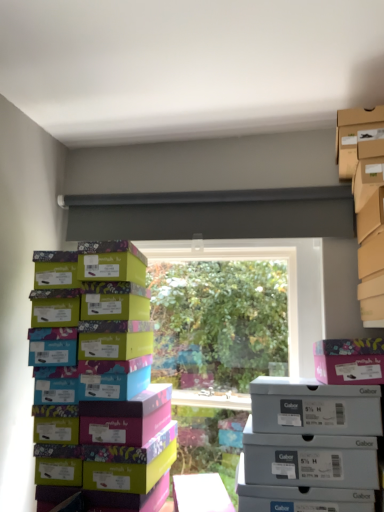
Question: Is gray matte shoebox at lower right, the second storage box positioned from the top, further to the viewer compared to cardboard shoebox at upper right, placed as the 1th storage box when sorted from top to bottom?

Choices:
 (A) no
 (B) yes

Answer: (A)

Question: Is gray matte shoebox at lower right, the second storage box positioned from the top, surrounding cardboard shoebox at upper right, placed as the 1th storage box when sorted from top to bottom?

Choices:
 (A) no
 (B) yes

Answer: (A)

Question: Could you tell me if gray matte shoebox at lower right, positioned as the 1th storage box in bottom-to-top order, is turned towards cardboard shoebox at upper right, placed as the 1th storage box when sorted from top to bottom?

Choices:
 (A) yes
 (B) no

Answer: (B)

Question: From the image's perspective, would you say gray matte shoebox at lower right, positioned as the 1th storage box in bottom-to-top order, is positioned over cardboard shoebox at upper right, the second storage box ordered from the bottom?

Choices:
 (A) no
 (B) yes

Answer: (A)

Question: Is gray matte shoebox at lower right, the second storage box positioned from the top, bigger than cardboard shoebox at upper right, placed as the 1th storage box when sorted from top to bottom?

Choices:
 (A) yes
 (B) no

Answer: (A)

Question: From a real-world perspective, is gray matte shoebox at lower right, positioned as the 1th storage box in bottom-to-top order, on top of cardboard shoebox at upper right, placed as the 1th storage box when sorted from top to bottom?

Choices:
 (A) no
 (B) yes

Answer: (A)

Question: Is pink cardboard box at upper right thinner than cardboard shoebox at upper right, the second storage box ordered from the bottom?

Choices:
 (A) no
 (B) yes

Answer: (B)

Question: From the image's perspective, would you say pink cardboard box at upper right is shown under cardboard shoebox at upper right, the second storage box ordered from the bottom?

Choices:
 (A) yes
 (B) no

Answer: (A)

Question: Considering the relative sizes of pink cardboard box at upper right and cardboard shoebox at upper right, placed as the 1th storage box when sorted from top to bottom, in the image provided, is pink cardboard box at upper right bigger than cardboard shoebox at upper right, placed as the 1th storage box when sorted from top to bottom,?

Choices:
 (A) no
 (B) yes

Answer: (A)

Question: Is pink cardboard box at upper right oriented towards cardboard shoebox at upper right, the second storage box ordered from the bottom?

Choices:
 (A) no
 (B) yes

Answer: (A)

Question: Is pink cardboard box at upper right positioned behind cardboard shoebox at upper right, the second storage box ordered from the bottom?

Choices:
 (A) yes
 (B) no

Answer: (B)

Question: Is the surface of pink cardboard box at upper right in direct contact with cardboard shoebox at upper right, placed as the 1th storage box when sorted from top to bottom?

Choices:
 (A) no
 (B) yes

Answer: (A)

Question: Is gray matte shoebox at lower right, the second storage box positioned from the top, next to pink cardboard box at upper right and touching it?

Choices:
 (A) yes
 (B) no

Answer: (B)